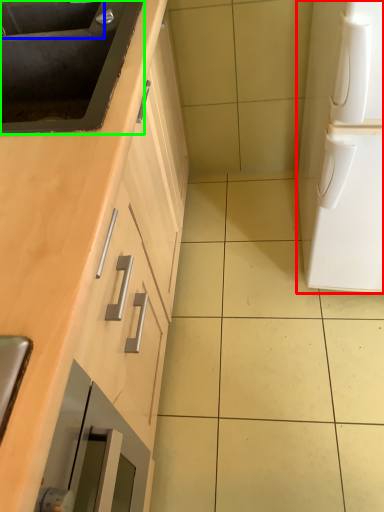
Question: Estimate the real-world distances between objects in this image. Which object is farther from home appliance (highlighted by a red box), sink (highlighted by a blue box) or sink (highlighted by a green box)?

Choices:
 (A) sink
 (B) sink

Answer: (A)